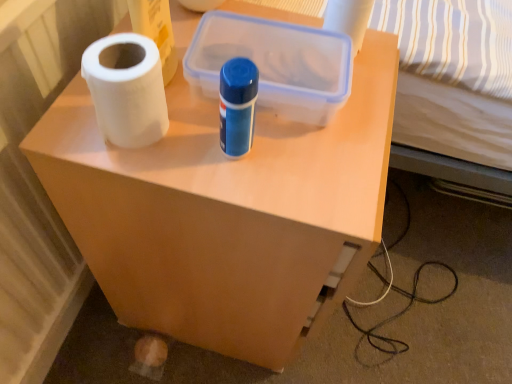
This screenshot has width=512, height=384. In order to click on vacant space to the right of transparent plastic storage box at center in this screenshot , I will do `click(369, 99)`.